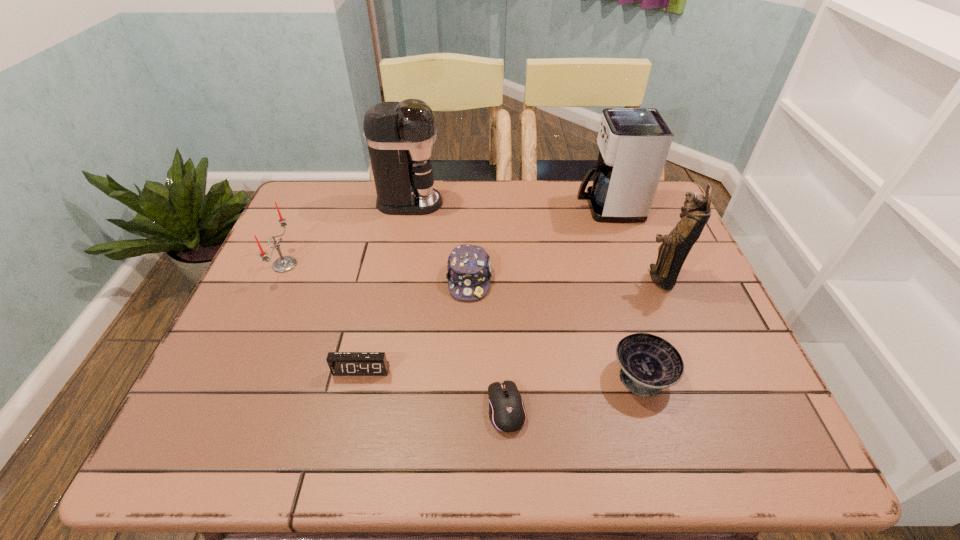
This screenshot has height=540, width=960. Find the location of `vacant space positioned 0.130m on the left of the computer mouse`. vacant space positioned 0.130m on the left of the computer mouse is located at coordinates (422, 409).

The height and width of the screenshot is (540, 960). Find the location of `object present at the near edge`. object present at the near edge is located at coordinates (507, 413).

I want to click on object situated at the left edge, so click(285, 263).

Image resolution: width=960 pixels, height=540 pixels. What are the coordinates of `coffee maker that is at the right edge` in the screenshot? It's located at (634, 143).

Where is `figurine that is at the right edge`? Image resolution: width=960 pixels, height=540 pixels. figurine that is at the right edge is located at coordinates (672, 253).

What are the coordinates of `object that is at the far right corner` in the screenshot? It's located at (634, 143).

Image resolution: width=960 pixels, height=540 pixels. In the image, there is a desktop. Identify the location of vacant region at the far edge. (510, 195).

Image resolution: width=960 pixels, height=540 pixels. What are the coordinates of `vacant space at the near edge of the desktop` in the screenshot? It's located at (410, 418).

At what (x,y) coordinates should I click in order to perform the action: click on blank space at the left edge of the desktop. Please return your answer as a coordinate pair (x, y). Image resolution: width=960 pixels, height=540 pixels. Looking at the image, I should click on (270, 290).

Find the location of `free space at the right edge`. free space at the right edge is located at coordinates (733, 343).